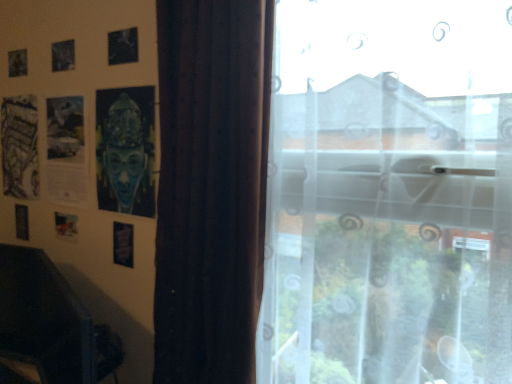
Locate an element on the screen. transparent sheer curtain at right is located at coordinates (387, 236).

You are a GUI agent. You are given a task and a screenshot of the screen. Output one action in this format:
    pyautogui.click(x=<x>, y=<y>)
    Task: Click on the metallic silver picture frame at lower left
    The width and height of the screenshot is (512, 384).
    Given the screenshot: What is the action you would take?
    pyautogui.click(x=123, y=244)

What do you see at coordinates (123, 244) in the screenshot? The image size is (512, 384). I see `metallic silver picture frame at lower left` at bounding box center [123, 244].

This screenshot has width=512, height=384. Describe the element at coordinates (126, 150) in the screenshot. I see `blue matte mask at upper left` at that location.

Locate an element on the screen. transparent sheer curtain at right is located at coordinates (387, 236).

From a real-world perspective, who is located lower, dark brown textured curtain at center or metallic silver picture frame at lower left?

metallic silver picture frame at lower left, from a real-world perspective.

Can metallic silver picture frame at lower left be found inside dark brown textured curtain at center?

Definitely not — metallic silver picture frame at lower left is not inside dark brown textured curtain at center.

Which of these two, dark brown textured curtain at center or metallic silver picture frame at lower left, stands shorter?

Standing shorter between the two is metallic silver picture frame at lower left.

From a real-world perspective, is transparent sheer curtain at right below metallic silver picture frame at lower left?

Incorrect, from a real-world perspective, transparent sheer curtain at right is higher than metallic silver picture frame at lower left.

Does transparent sheer curtain at right have a greater width compared to metallic silver picture frame at lower left?

Yes.

Which is in front, point (400, 260) or point (123, 241)?

The point (400, 260) is in front.

How different are the orientations of transparent sheer curtain at right and metallic silver picture frame at lower left in degrees?

The facing directions of transparent sheer curtain at right and metallic silver picture frame at lower left are 1.13 degrees apart.

Is blue matte mask at upper left next to black plastic swivel chair at lower left and touching it?

No, blue matte mask at upper left is not next to black plastic swivel chair at lower left.

Could black plastic swivel chair at lower left be considered to be inside blue matte mask at upper left?

No.

How far apart are blue matte mask at upper left and black plastic swivel chair at lower left?

blue matte mask at upper left is 16.04 inches away from black plastic swivel chair at lower left.

From a real-world perspective, is blue matte mask at upper left physically above black plastic swivel chair at lower left?

Indeed, from a real-world perspective, blue matte mask at upper left stands above black plastic swivel chair at lower left.

Is black plastic swivel chair at lower left wider than transparent sheer curtain at right?

Incorrect, the width of black plastic swivel chair at lower left does not surpass that of transparent sheer curtain at right.

Consider the image. Considering the relative positions of black plastic swivel chair at lower left and transparent sheer curtain at right in the image provided, is black plastic swivel chair at lower left in front of transparent sheer curtain at right?

That is False.

Is black plastic swivel chair at lower left far from transparent sheer curtain at right?

No, black plastic swivel chair at lower left is in close proximity to transparent sheer curtain at right.

How far apart are black plastic swivel chair at lower left and transparent sheer curtain at right?

black plastic swivel chair at lower left and transparent sheer curtain at right are 29.29 inches apart.

Considering the sizes of objects black plastic swivel chair at lower left and metallic silver picture frame at lower left in the image provided, who is bigger, black plastic swivel chair at lower left or metallic silver picture frame at lower left?

With larger size is black plastic swivel chair at lower left.

Where is `picture frame lying behind the black plastic swivel chair at lower left`? This screenshot has width=512, height=384. picture frame lying behind the black plastic swivel chair at lower left is located at coordinates coord(123,244).

Does point (66, 383) come farther from viewer compared to point (132, 254)?

No, (66, 383) is in front of (132, 254).

Is black plastic swivel chair at lower left directly adjacent to metallic silver picture frame at lower left?

No.

Based on the photo, from a real-world perspective, is metallic silver picture frame at lower left over transparent sheer curtain at right?

No.

Is metallic silver picture frame at lower left far away from transparent sheer curtain at right?

No, metallic silver picture frame at lower left is not far from transparent sheer curtain at right.

Is transparent sheer curtain at right a part of metallic silver picture frame at lower left?

Definitely not — transparent sheer curtain at right is not inside metallic silver picture frame at lower left.

Considering the points (124, 252) and (458, 164), which point is behind, point (124, 252) or point (458, 164)?

The point (124, 252) is farther.

Is blue matte mask at upper left to the left or to the right of dark brown textured curtain at center in the image?

Based on their positions, blue matte mask at upper left is located to the left of dark brown textured curtain at center.

From a real-world perspective, is blue matte mask at upper left on dark brown textured curtain at center?

Correct, in the physical world, blue matte mask at upper left is higher than dark brown textured curtain at center.

Looking at this image, from the image's perspective, is blue matte mask at upper left on dark brown textured curtain at center?

Yes, from the image's perspective, blue matte mask at upper left is on top of dark brown textured curtain at center.

Between blue matte mask at upper left and dark brown textured curtain at center, which one has smaller width?

blue matte mask at upper left is thinner.

I want to click on picture frame on the left side of dark brown textured curtain at center, so click(123, 244).

I want to click on picture frame behind the transparent sheer curtain at right, so pos(123,244).

Considering their positions, is metallic silver picture frame at lower left positioned further to black plastic swivel chair at lower left than dark brown textured curtain at center?

Among the two, dark brown textured curtain at center is located further to black plastic swivel chair at lower left.

Which object lies further to the anchor point blue matte mask at upper left, transparent sheer curtain at right or metallic silver picture frame at lower left?

transparent sheer curtain at right lies further to blue matte mask at upper left than the other object.

Looking at the image, which one is located closer to metallic silver picture frame at lower left, blue matte mask at upper left or dark brown textured curtain at center?

blue matte mask at upper left.

From the image, which object appears to be farther from dark brown textured curtain at center, metallic silver picture frame at lower left or transparent sheer curtain at right?

Among the two, metallic silver picture frame at lower left is located further to dark brown textured curtain at center.

Looking at the image, which one is located closer to dark brown textured curtain at center, black plastic swivel chair at lower left or blue matte mask at upper left?

The object closer to dark brown textured curtain at center is blue matte mask at upper left.

Based on their spatial positions, is black plastic swivel chair at lower left or metallic silver picture frame at lower left further from transparent sheer curtain at right?

Among the two, metallic silver picture frame at lower left is located further to transparent sheer curtain at right.

Which object lies nearer to the anchor point metallic silver picture frame at lower left, black plastic swivel chair at lower left or dark brown textured curtain at center?

The object closer to metallic silver picture frame at lower left is black plastic swivel chair at lower left.

Considering their positions, is transparent sheer curtain at right positioned closer to black plastic swivel chair at lower left than blue matte mask at upper left?

Among the two, blue matte mask at upper left is located nearer to black plastic swivel chair at lower left.

This screenshot has width=512, height=384. I want to click on picture frame situated between black plastic swivel chair at lower left and transparent sheer curtain at right from left to right, so click(123, 244).

Locate an element on the screen. curtain located between black plastic swivel chair at lower left and transparent sheer curtain at right in the left-right direction is located at coordinates (211, 187).

The image size is (512, 384). What are the coordinates of `person between dark brown textured curtain at center and metallic silver picture frame at lower left from front to back` in the screenshot? It's located at (126, 150).

At what (x,y) coordinates should I click in order to perform the action: click on swivel chair between dark brown textured curtain at center and blue matte mask at upper left along the z-axis. Please return your answer as a coordinate pair (x, y). Looking at the image, I should click on (50, 322).